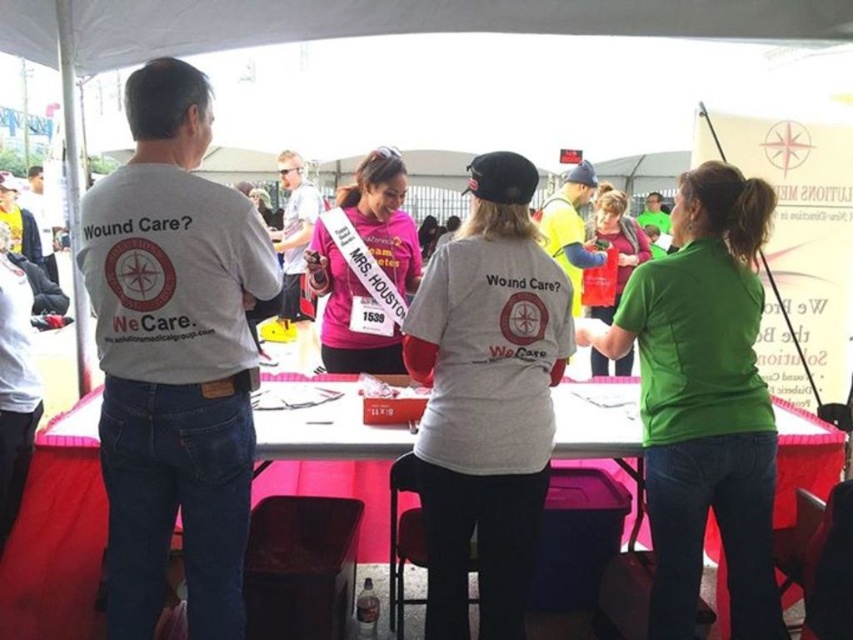
You are standing at point (293,195) and want to walk to the table with the pink cloth. There is a person at point (729,364) blocking your path. Can you walk around them to reach the table?

Point (729,364) is in front of point (293,195), so the person at point (729,364) is blocking your path. You will need to go around them to reach the table.

You are a participant in the event and want to place a water bottle on the white plastic table at center. However, you are currently standing next to the matte pink shirt at center. Can you reach the table without moving more than 10 feet?

The white plastic table at center and matte pink shirt at center are 9.56 feet apart, so yes, you can reach the table without moving more than 10 feet since 9.56 is less than 10.

You are attending the event and need to find the tallest person between the green matte shirt at center and the matte pink shirt at center. Which one should you approach?

The green matte shirt at center is taller than the matte pink shirt at center, so you should approach the green matte shirt at center.